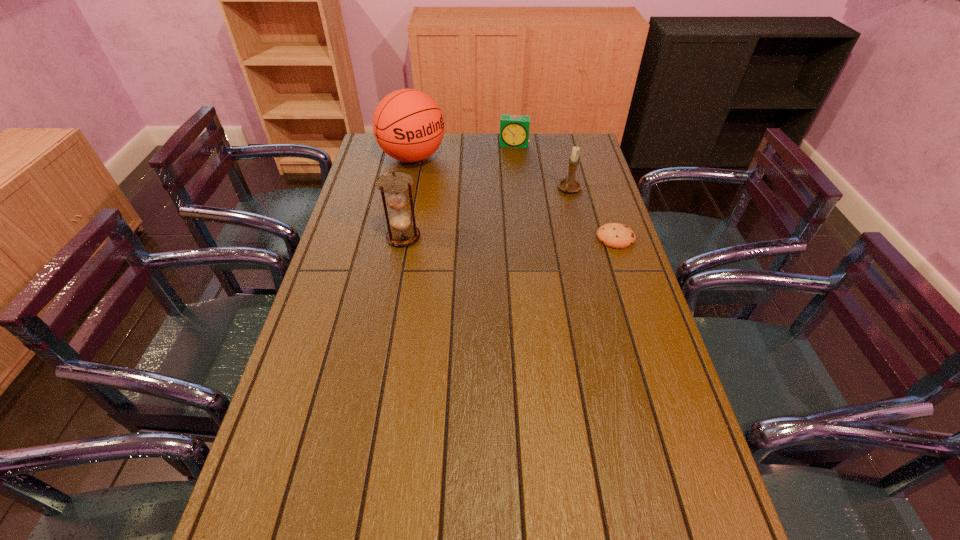
Find the location of `alarm clock that is at the far edge`. alarm clock that is at the far edge is located at coordinates (514, 129).

This screenshot has width=960, height=540. Identify the location of hourglass that is at the left edge. (402, 233).

Locate an element on the screen. This screenshot has height=540, width=960. basketball present at the left edge is located at coordinates (408, 125).

I want to click on cookie located at the right edge, so click(614, 235).

I want to click on candle holder located in the right edge section of the desktop, so click(570, 184).

I want to click on object located at the far left corner, so click(408, 125).

At what (x,y) coordinates should I click in order to perform the action: click on vacant space at the far edge. Please return your answer as a coordinate pair (x, y). This screenshot has height=540, width=960. Looking at the image, I should click on (513, 158).

This screenshot has height=540, width=960. Find the location of `vacant space at the left edge of the desktop`. vacant space at the left edge of the desktop is located at coordinates (334, 256).

Find the location of a particular element. This screenshot has height=540, width=960. free region at the far left corner of the desktop is located at coordinates (378, 152).

At what (x,y) coordinates should I click in order to perform the action: click on free space that is in between the rightmost object and the candle holder. Please return your answer as a coordinate pair (x, y). The height and width of the screenshot is (540, 960). Looking at the image, I should click on (592, 214).